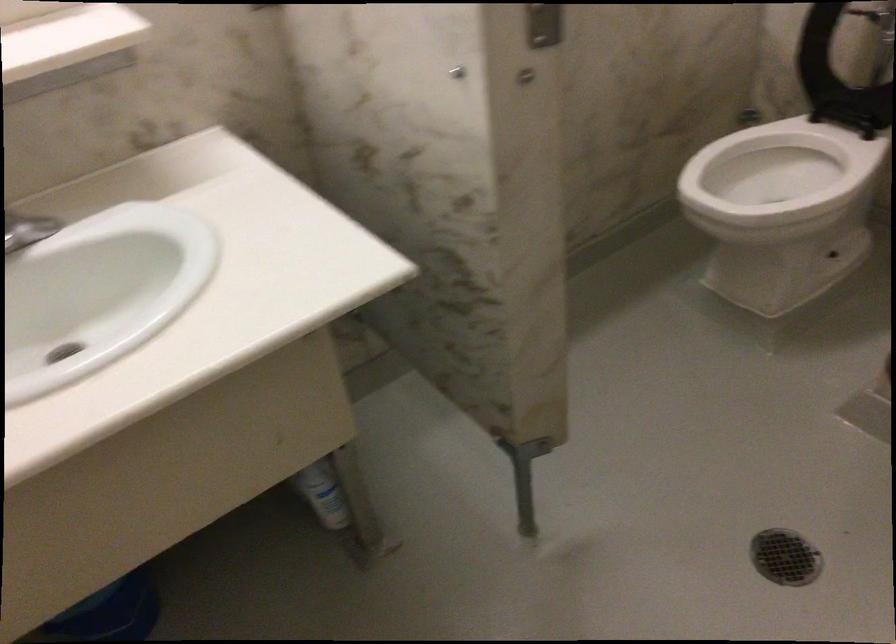
Locate an element on the screen. The height and width of the screenshot is (644, 896). metal stall lock is located at coordinates (544, 24).